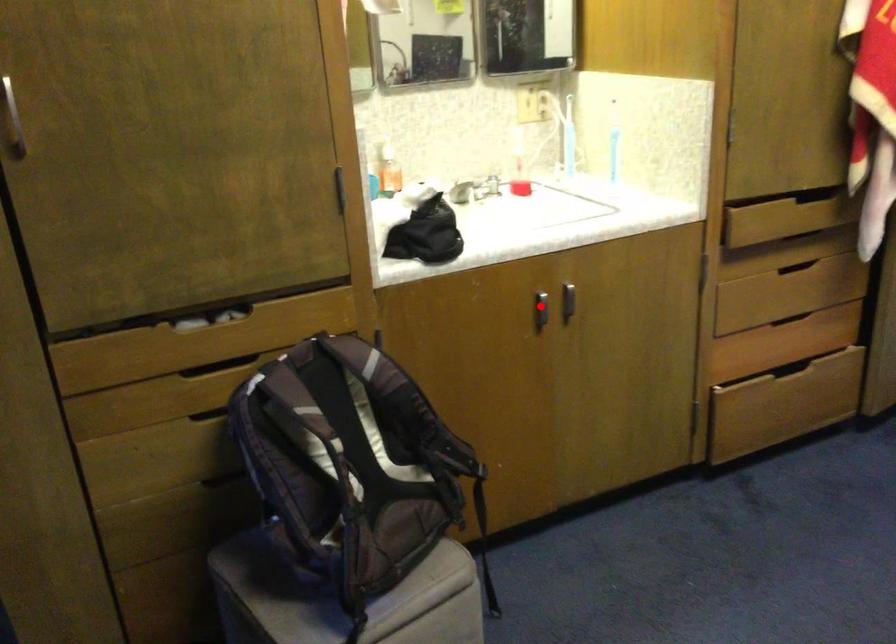
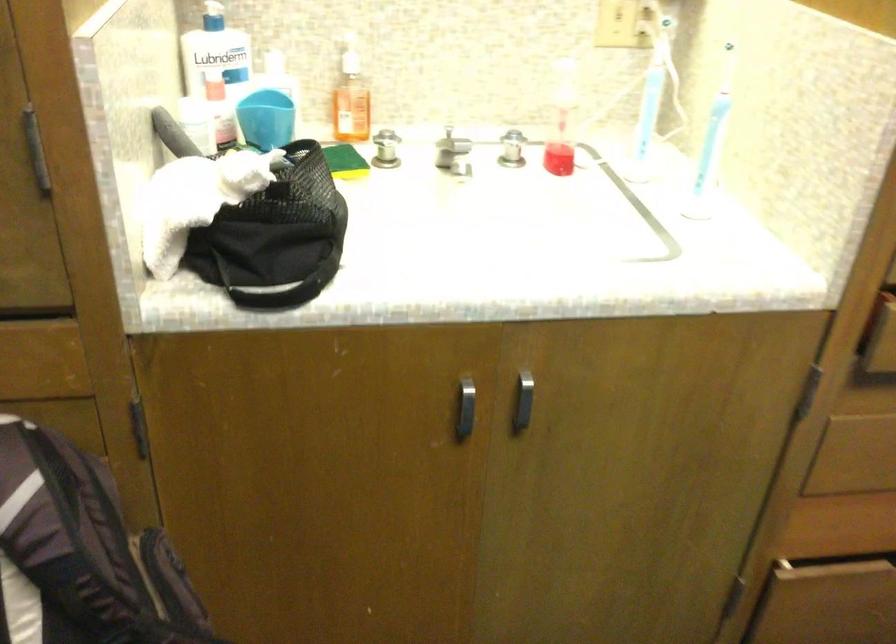
In the second image, find the point that corresponds to the highlighted location in the first image.

(464, 409)